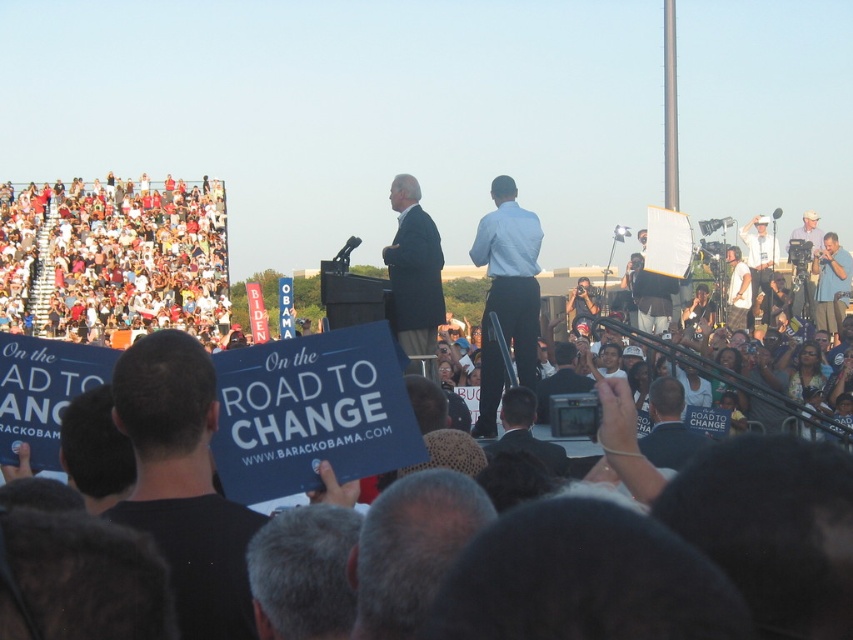
You are a photographer at the rally and want to capture both the dark blue shirt at center and the blue shirt at right in a single photo. Based on their positions, which shirt should you focus on first to ensure both are in frame?

The dark blue shirt at center is below the blue shirt at right, so focusing on the blue shirt at right first will help ensure both are in frame as the dark blue shirt at center is positioned lower.

You are a photographer at the rally and need to capture both the light blue shirt at center and the dark gray suit at center in a single frame. Given that your camera has a fixed focal length, which subject should you position closer to the camera to ensure both fit in the frame?

The light blue shirt at center is narrower than the dark gray suit at center. To ensure both fit in the frame, position the light blue shirt at center closer to the camera since its smaller width requires less space, allowing the wider dark gray suit at center to be accommodated in the frame as well.

You are a photographer at this rally and want to capture both the white cotton crowd at upper left and the white cotton shirt at right in a single shot. Based on their positions, which one will appear closer to the camera in the photo?

The white cotton crowd at upper left is in front of the white cotton shirt at right, so it will appear closer to the camera in the photo.